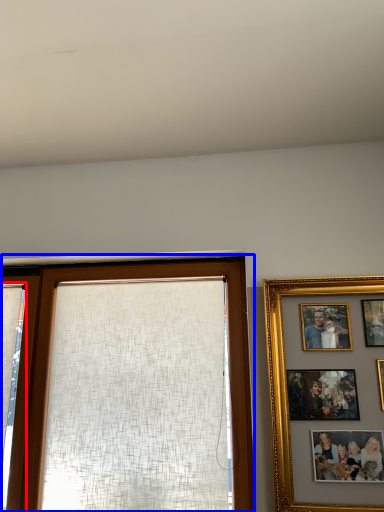
Question: Which point is closer to the camera, curtain (highlighted by a red box) or window (highlighted by a blue box)?

Choices:
 (A) curtain
 (B) window

Answer: (B)